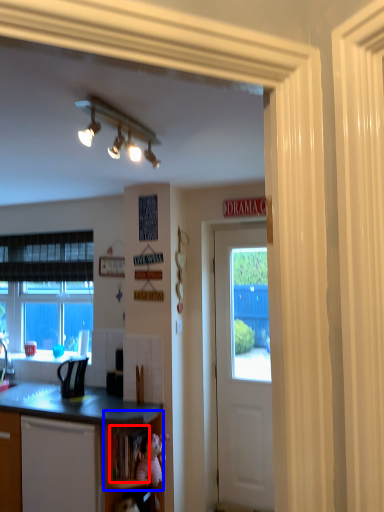
Question: Which object appears farthest to the camera in this image, shelf (highlighted by a red box) or shelf (highlighted by a blue box)?

Choices:
 (A) shelf
 (B) shelf

Answer: (A)